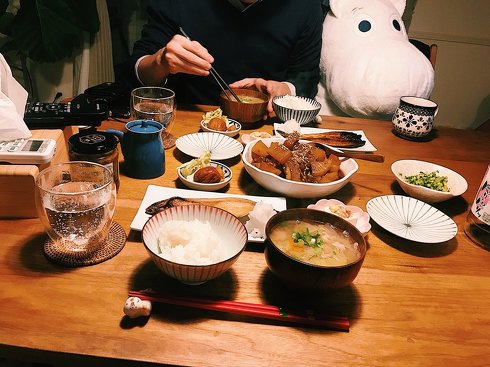
This screenshot has width=490, height=367. In order to click on wood tabletop in this screenshot , I will do `click(398, 316)`.